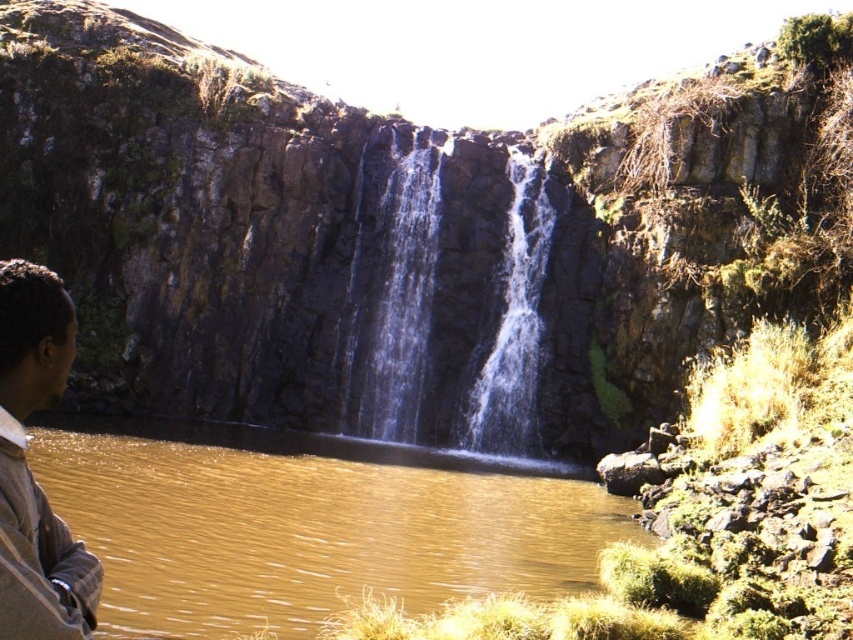
You are standing at the center of the scene observing the brown plaid shirt at lower left. Which direction should you move to get closer to it?

The brown plaid shirt at lower left is located at point (28, 468), which is to the lower left of your current position. To move closer, you should head towards the lower left direction.